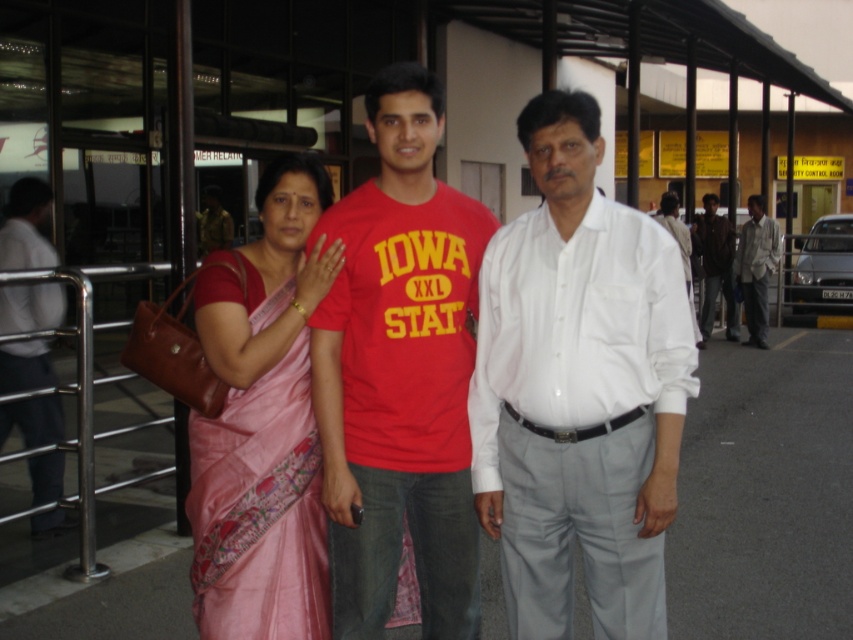
Question: Is light gray cotton shirt at right smaller than dark brown leather jacket at right?

Choices:
 (A) no
 (B) yes

Answer: (B)

Question: Observing the image, what is the correct spatial positioning of white shirt at left in reference to white cotton shirt at left?

Choices:
 (A) right
 (B) left

Answer: (B)

Question: Which point is farther to the camera?

Choices:
 (A) (33, 387)
 (B) (364, 586)
 (C) (303, 524)

Answer: (A)

Question: Which is nearer to the white shirt at left?

Choices:
 (A) light gray cotton shirt at right
 (B) white cotton shirt at left

Answer: (B)

Question: Does pink silk saree at center appear over light gray cotton shirt at right?

Choices:
 (A) yes
 (B) no

Answer: (B)

Question: Which of the following is the farthest from the observer?

Choices:
 (A) (22, 292)
 (B) (426, 596)
 (C) (583, 321)
 (D) (331, 342)

Answer: (A)